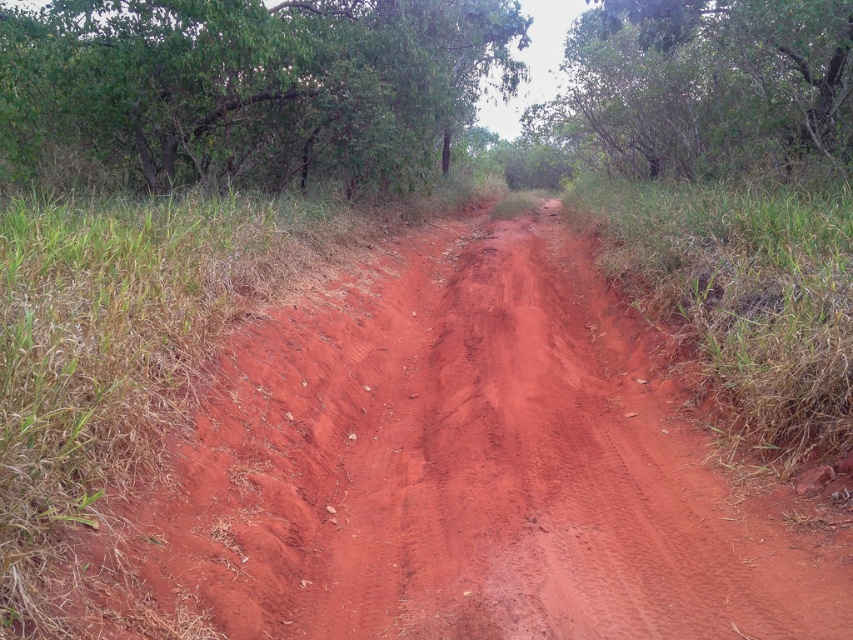
Does green leafy tree at upper left come behind green leafy tree at upper center?

Yes, it is.

Can you confirm if green leafy tree at upper left is positioned below green leafy tree at upper center?

Correct, green leafy tree at upper left is located below green leafy tree at upper center.

You are a GUI agent. You are given a task and a screenshot of the screen. Output one action in this format:
    pyautogui.click(x=<x>, y=<y>)
    Task: Click on the green leafy tree at upper left
    
    Given the screenshot: What is the action you would take?
    pyautogui.click(x=247, y=86)

In the scene shown: Can you confirm if dusty red dirt track at center is wider than green leafy tree at upper center?

In fact, dusty red dirt track at center might be narrower than green leafy tree at upper center.

Between point (810, 563) and point (845, 160), which one is positioned in front?

Point (810, 563) is more forward.

Image resolution: width=853 pixels, height=640 pixels. What do you see at coordinates (451, 470) in the screenshot? I see `dusty red dirt track at center` at bounding box center [451, 470].

Locate an element on the screen. The width and height of the screenshot is (853, 640). dusty red dirt track at center is located at coordinates (451, 470).

Which is more to the right, dusty red dirt track at center or green leafy tree at upper left?

From the viewer's perspective, dusty red dirt track at center appears more on the right side.

Is dusty red dirt track at center to the right of green leafy tree at upper left from the viewer's perspective?

Correct, you'll find dusty red dirt track at center to the right of green leafy tree at upper left.

What do you see at coordinates (451, 470) in the screenshot?
I see `dusty red dirt track at center` at bounding box center [451, 470].

In order to click on dusty red dirt track at center in this screenshot , I will do `click(451, 470)`.